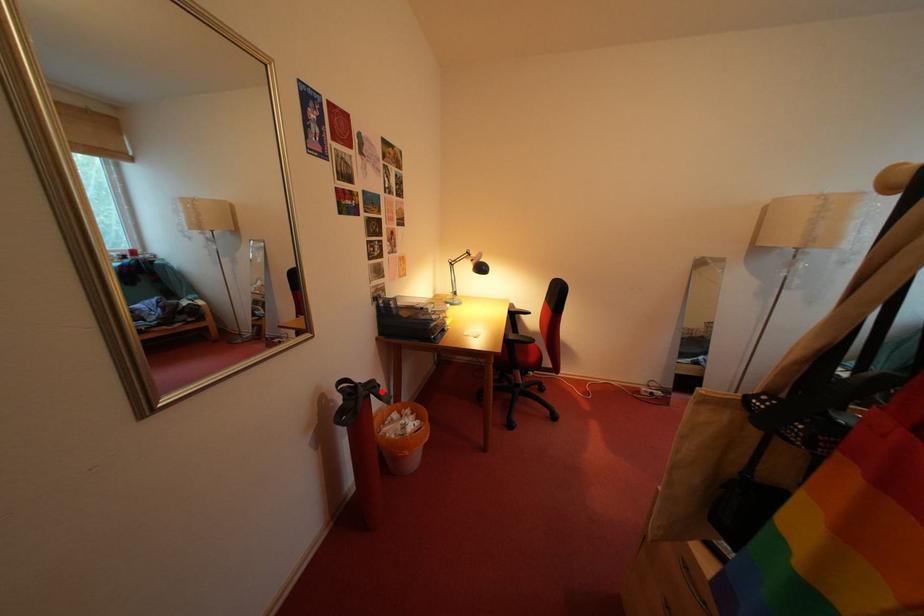
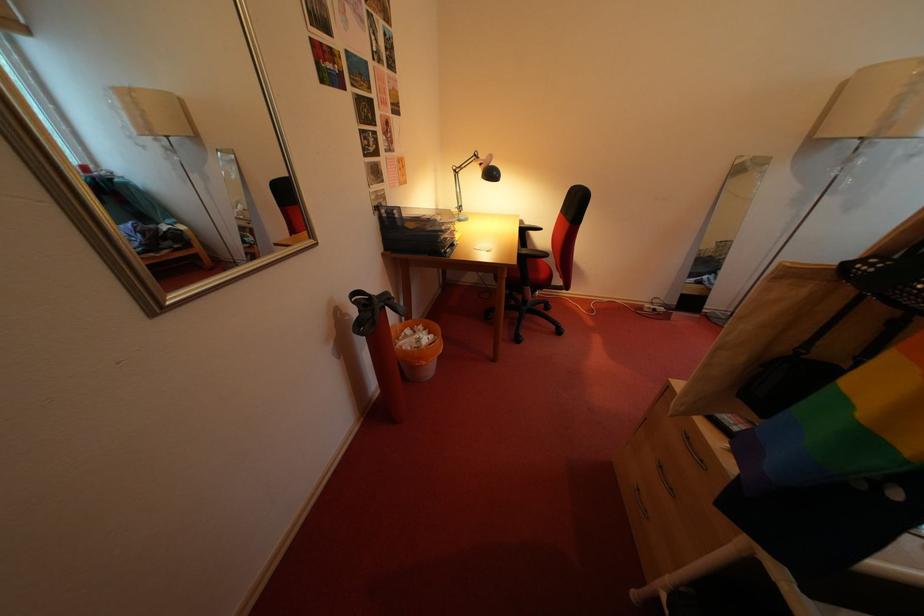
Find the pixel in the second image that matches the highlighted location in the first image.

(395, 304)